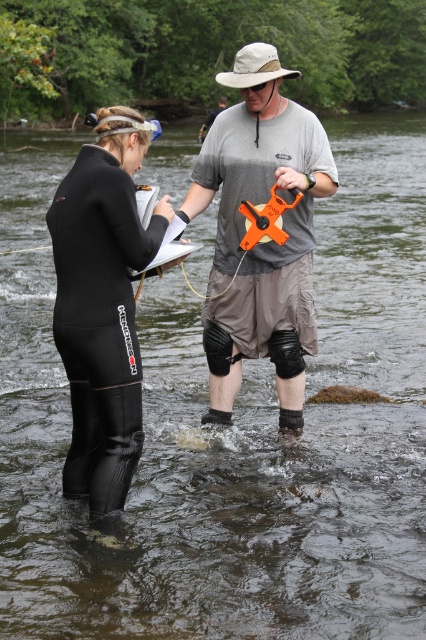
How much distance is there between gray fabric shirt at center and black neoprene wetsuit at left?

gray fabric shirt at center and black neoprene wetsuit at left are 1.31 meters apart.

Between point (264, 115) and point (114, 145), which one is positioned behind?

Point (264, 115)

Is point (256, 244) more distant than point (129, 225)?

Yes, it is behind point (129, 225).

The image size is (426, 640). Find the location of `gray fabric shirt at center`. gray fabric shirt at center is located at coordinates (261, 237).